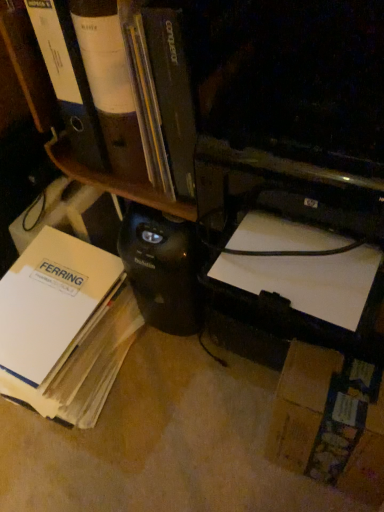
This screenshot has width=384, height=512. What are the coordinates of `matte black bookshelf at upper center` in the screenshot? It's located at (117, 182).

In order to face matte black bookshelf at upper center, should I rotate leftwards or rightwards?

Turn left by 7.972 degrees to look at matte black bookshelf at upper center.

Describe the element at coordinates (117, 182) in the screenshot. I see `matte black bookshelf at upper center` at that location.

What is the approximate height of white paper at lower left?

The height of white paper at lower left is 11.51 inches.

Describe the element at coordinates (64, 327) in the screenshot. I see `white paper at lower left` at that location.

This screenshot has width=384, height=512. In order to click on white paper at lower left in this screenshot , I will do `click(64, 327)`.

I want to click on matte black bookshelf at upper center, so (117, 182).

Visually, is white paper at lower left positioned to the left or to the right of matte black bookshelf at upper center?

Based on their positions, white paper at lower left is located to the left of matte black bookshelf at upper center.

Does white paper at lower left lie in front of matte black bookshelf at upper center?

No, it is not.

Which is closer to the camera, (x=61, y=411) or (x=28, y=88)?

The point (x=28, y=88) is more forward.

From the image's perspective, is white paper at lower left above or below matte black bookshelf at upper center?

white paper at lower left is situated lower than matte black bookshelf at upper center in the image.

From a real-world perspective, is white paper at lower left beneath matte black bookshelf at upper center?

Yes, from a real-world perspective, white paper at lower left is below matte black bookshelf at upper center.

Which object is wider, white paper at lower left or matte black bookshelf at upper center?

white paper at lower left is wider.

Considering the sizes of white paper at lower left and matte black bookshelf at upper center in the image, is white paper at lower left taller or shorter than matte black bookshelf at upper center?

white paper at lower left is shorter than matte black bookshelf at upper center.

Consider the image. Considering the relative sizes of white paper at lower left and matte black bookshelf at upper center in the image provided, is white paper at lower left smaller than matte black bookshelf at upper center?

Actually, white paper at lower left might be larger than matte black bookshelf at upper center.

Which is correct: white paper at lower left is inside matte black bookshelf at upper center, or outside of it?

white paper at lower left exists outside the volume of matte black bookshelf at upper center.

Are white paper at lower left and matte black bookshelf at upper center located far from each other?

No, there isn't a large distance between white paper at lower left and matte black bookshelf at upper center.

Is white paper at lower left turned away from matte black bookshelf at upper center?

white paper at lower left is not turned away from matte black bookshelf at upper center.

Locate an element on the screen. bookshelf above the white paper at lower left (from the image's perspective) is located at coordinates (117, 182).

Does matte black bookshelf at upper center appear on the right side of white paper at lower left?

Indeed, matte black bookshelf at upper center is positioned on the right side of white paper at lower left.

Which is in front, matte black bookshelf at upper center or white paper at lower left?

matte black bookshelf at upper center is in front.

Considering the points (19, 30) and (27, 250), which point is in front, point (19, 30) or point (27, 250)?

Point (19, 30)

From the image's perspective, is matte black bookshelf at upper center under white paper at lower left?

Incorrect, from the image's perspective, matte black bookshelf at upper center is higher than white paper at lower left.

From a real-world perspective, which is physically above, matte black bookshelf at upper center or white paper at lower left?

matte black bookshelf at upper center, from a real-world perspective.

Can you confirm if matte black bookshelf at upper center is thinner than white paper at lower left?

Indeed, matte black bookshelf at upper center has a lesser width compared to white paper at lower left.

Considering the sizes of matte black bookshelf at upper center and white paper at lower left in the image, is matte black bookshelf at upper center taller or shorter than white paper at lower left?

Considering their sizes, matte black bookshelf at upper center has more height than white paper at lower left.

Looking at the image, does matte black bookshelf at upper center seem bigger or smaller compared to white paper at lower left?

Considering their sizes, matte black bookshelf at upper center takes up less space than white paper at lower left.

Would you say matte black bookshelf at upper center is outside white paper at lower left?

Yes, matte black bookshelf at upper center is outside of white paper at lower left.

Is matte black bookshelf at upper center in contact with white paper at lower left?

No, matte black bookshelf at upper center is not making contact with white paper at lower left.

Is matte black bookshelf at upper center facing away from white paper at lower left?

matte black bookshelf at upper center is not turned away from white paper at lower left.

Can you tell me how much matte black bookshelf at upper center and white paper at lower left differ in facing direction?

2.11 degrees separate the facing orientations of matte black bookshelf at upper center and white paper at lower left.

The image size is (384, 512). Identify the location of book lying below the matte black bookshelf at upper center (from the image's perspective). [64, 327].

The width and height of the screenshot is (384, 512). I want to click on bookshelf located above the white paper at lower left (from the image's perspective), so click(117, 182).

I want to click on book on the left of the matte black bookshelf at upper center, so click(x=64, y=327).